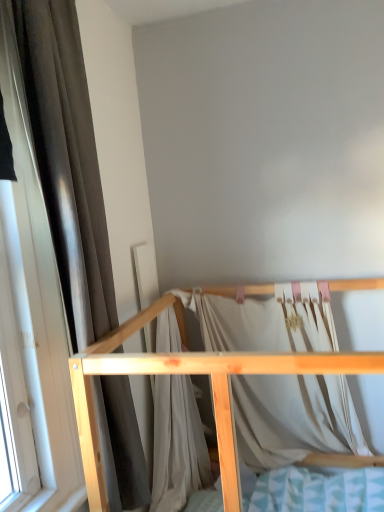
Question: From a real-world perspective, is brown fabric curtain at left physically below natural wood bed frame at center?

Choices:
 (A) yes
 (B) no

Answer: (B)

Question: Is brown fabric curtain at left not within natural wood bed frame at center?

Choices:
 (A) yes
 (B) no

Answer: (A)

Question: Is brown fabric curtain at left shorter than natural wood bed frame at center?

Choices:
 (A) yes
 (B) no

Answer: (B)

Question: Considering the relative sizes of brown fabric curtain at left and natural wood bed frame at center in the image provided, is brown fabric curtain at left wider than natural wood bed frame at center?

Choices:
 (A) no
 (B) yes

Answer: (A)

Question: From the image's perspective, is brown fabric curtain at left located beneath natural wood bed frame at center?

Choices:
 (A) yes
 (B) no

Answer: (B)

Question: Can you confirm if brown fabric curtain at left is positioned to the left of natural wood bed frame at center?

Choices:
 (A) no
 (B) yes

Answer: (B)

Question: Can you confirm if natural wood bed frame at center is bigger than brown fabric curtain at left?

Choices:
 (A) no
 (B) yes

Answer: (B)

Question: From the image's perspective, is natural wood bed frame at center on brown fabric curtain at left?

Choices:
 (A) no
 (B) yes

Answer: (A)

Question: Is brown fabric curtain at left inside natural wood bed frame at center?

Choices:
 (A) no
 (B) yes

Answer: (A)

Question: From the image's perspective, would you say natural wood bed frame at center is shown under brown fabric curtain at left?

Choices:
 (A) no
 (B) yes

Answer: (B)

Question: Is natural wood bed frame at center smaller than brown fabric curtain at left?

Choices:
 (A) yes
 (B) no

Answer: (B)

Question: Is natural wood bed frame at center oriented away from brown fabric curtain at left?

Choices:
 (A) no
 (B) yes

Answer: (A)

Question: From a real-world perspective, is natural wood bed frame at center above or below brown fabric curtain at left?

Choices:
 (A) above
 (B) below

Answer: (B)